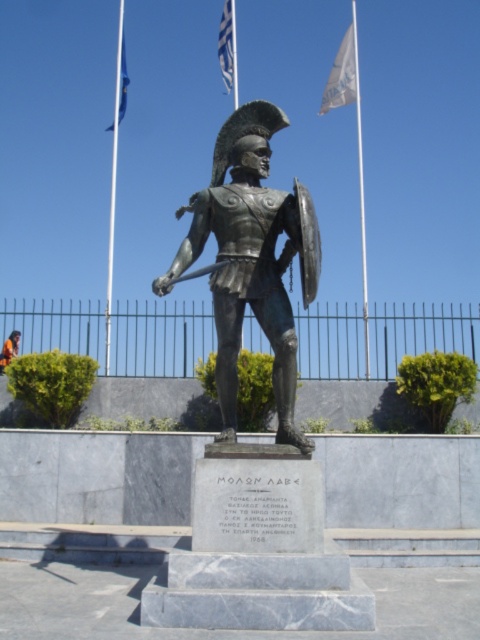
Looking at this image, you are a visitor at a historical site and see the white fabric flagpole at upper center and the blue fabric flag at upper left. Which object is located to the right of the other?

The white fabric flagpole at upper center is positioned on the right side of blue fabric flag at upper left.

You are a tourist standing in front of the bronze statue at center. You notice a white fabric flag at upper center. Based on the scene description, can you determine if the flag is positioned above or below the statue?

The bronze statue at center is below the white fabric flag at upper center, so the flag is positioned above the statue.